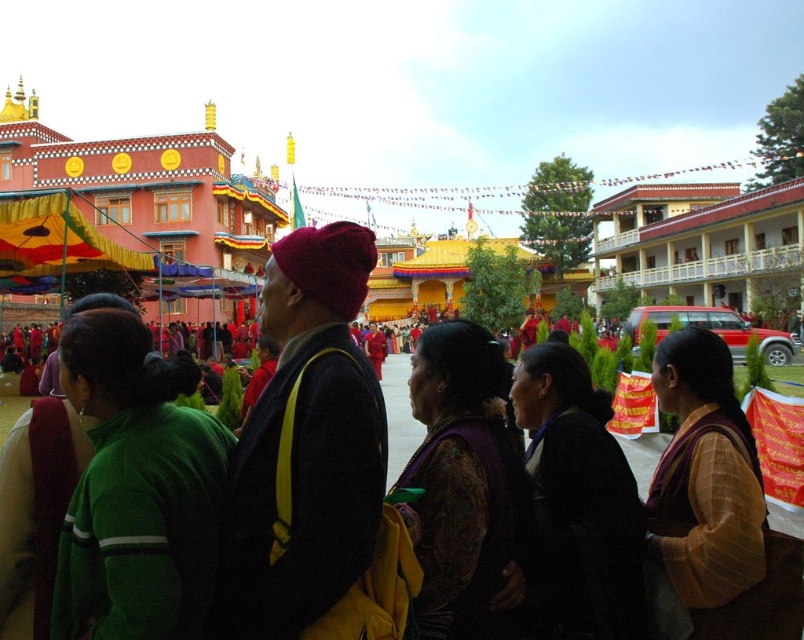
Can you confirm if dark purple velvet dress at center is taller than black velvet dress at center?

Yes.

What do you see at coordinates (464, 483) in the screenshot? I see `dark purple velvet dress at center` at bounding box center [464, 483].

Image resolution: width=804 pixels, height=640 pixels. What are the coordinates of `dark purple velvet dress at center` in the screenshot? It's located at [464, 483].

Between dark red woolen hat at center and silky yellow dress at center, which one has less height?

Standing shorter between the two is silky yellow dress at center.

Is dark red woolen hat at center smaller than silky yellow dress at center?

No, dark red woolen hat at center is not smaller than silky yellow dress at center.

Does point (290, 560) come behind point (747, 557)?

That is False.

This screenshot has width=804, height=640. What are the coordinates of `dark red woolen hat at center` in the screenshot? It's located at (306, 444).

Does dark purple velvet dress at center have a lesser width compared to silky yellow dress at center?

No.

Can you confirm if dark purple velvet dress at center is positioned below silky yellow dress at center?

Incorrect, dark purple velvet dress at center is not positioned below silky yellow dress at center.

Measure the distance between point (495,449) and camera.

They are 52.82 meters apart.

Where is `dark purple velvet dress at center`? dark purple velvet dress at center is located at coordinates (464, 483).